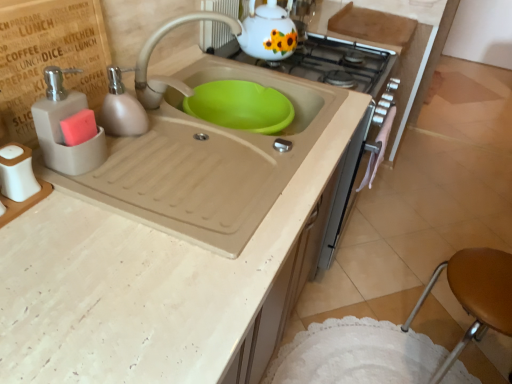
Identify the location of free area below matte beige faucet at sink center (from a real-world perspective). (170, 109).